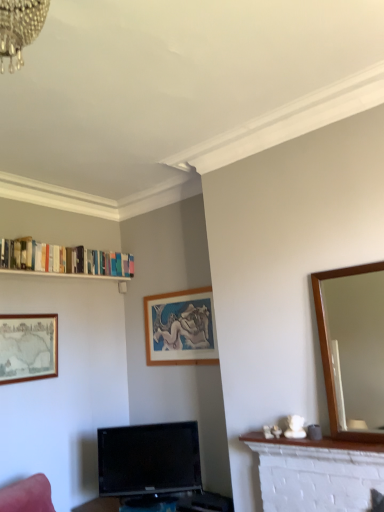
Question: Is black glossy tv at lower center closer to the viewer compared to white glossy bookshelf at upper left?

Choices:
 (A) no
 (B) yes

Answer: (B)

Question: Is black glossy tv at lower center wider than white glossy bookshelf at upper left?

Choices:
 (A) yes
 (B) no

Answer: (A)

Question: From a real-world perspective, is black glossy tv at lower center on top of white glossy bookshelf at upper left?

Choices:
 (A) yes
 (B) no

Answer: (B)

Question: Can you confirm if black glossy tv at lower center is smaller than white glossy bookshelf at upper left?

Choices:
 (A) yes
 (B) no

Answer: (B)

Question: From the image's perspective, is black glossy tv at lower center below white glossy bookshelf at upper left?

Choices:
 (A) yes
 (B) no

Answer: (A)

Question: Would you say white brick fireplace at lower right is inside or outside black glossy tv at lower center?

Choices:
 (A) inside
 (B) outside

Answer: (B)

Question: Is white brick fireplace at lower right in front of or behind black glossy tv at lower center in the image?

Choices:
 (A) behind
 (B) front

Answer: (B)

Question: Would you say white brick fireplace at lower right is to the left or to the right of black glossy tv at lower center in the picture?

Choices:
 (A) right
 (B) left

Answer: (A)

Question: From a real-world perspective, relative to black glossy tv at lower center, is white brick fireplace at lower right vertically above or below?

Choices:
 (A) below
 (B) above

Answer: (B)

Question: Would you say white glossy bookshelf at upper left is inside or outside white brick fireplace at lower right?

Choices:
 (A) outside
 (B) inside

Answer: (A)

Question: From the image's perspective, relative to white brick fireplace at lower right, is white glossy bookshelf at upper left above or below?

Choices:
 (A) below
 (B) above

Answer: (B)

Question: Would you say white glossy bookshelf at upper left is to the left or to the right of white brick fireplace at lower right in the picture?

Choices:
 (A) right
 (B) left

Answer: (B)

Question: Based on their sizes in the image, would you say white glossy bookshelf at upper left is bigger or smaller than white brick fireplace at lower right?

Choices:
 (A) small
 (B) big

Answer: (A)

Question: In terms of width, does white glossy bookshelf at upper left look wider or thinner when compared to wooden mirror at right?

Choices:
 (A) wide
 (B) thin

Answer: (A)

Question: From a real-world perspective, is white glossy bookshelf at upper left positioned above or below wooden mirror at right?

Choices:
 (A) below
 (B) above

Answer: (B)